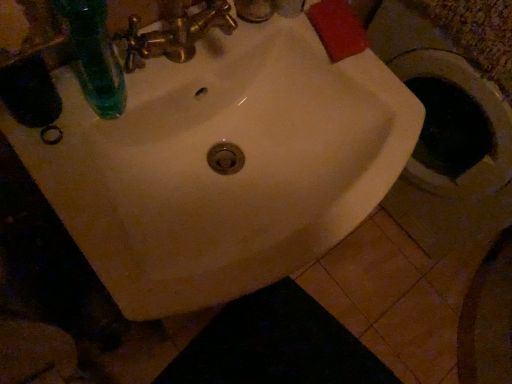
Question: Is point (205, 29) closer or farther from the camera than point (321, 243)?

Choices:
 (A) closer
 (B) farther

Answer: (B)

Question: From a real-world perspective, is gold metallic faucet at upper center positioned above or below white glossy sink at center?

Choices:
 (A) below
 (B) above

Answer: (B)

Question: Estimate the real-world distances between objects in this image. Which object is farther from the white glossy sink at center?

Choices:
 (A) gold metallic faucet at upper center
 (B) black fabric at lower center
 (C) green glass bottle at upper left

Answer: (B)

Question: Estimate the real-world distances between objects in this image. Which object is closer to the black fabric at lower center?

Choices:
 (A) white glossy sink at center
 (B) gold metallic faucet at upper center
 (C) green glass bottle at upper left

Answer: (A)